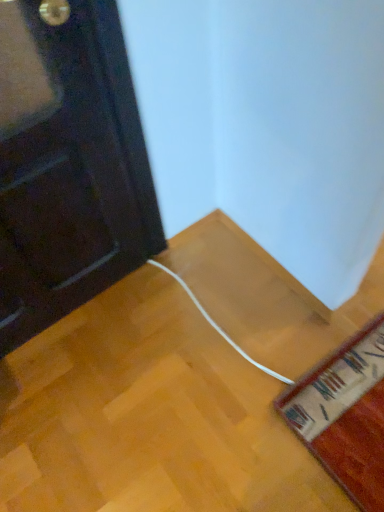
Measure the distance between black glossy door at left and camera.

black glossy door at left is 32.97 inches from camera.

What do you see at coordinates (68, 165) in the screenshot? I see `black glossy door at left` at bounding box center [68, 165].

The width and height of the screenshot is (384, 512). I want to click on black glossy door at left, so click(68, 165).

Find the location of a particular element. The height and width of the screenshot is (512, 384). black glossy door at left is located at coordinates (68, 165).